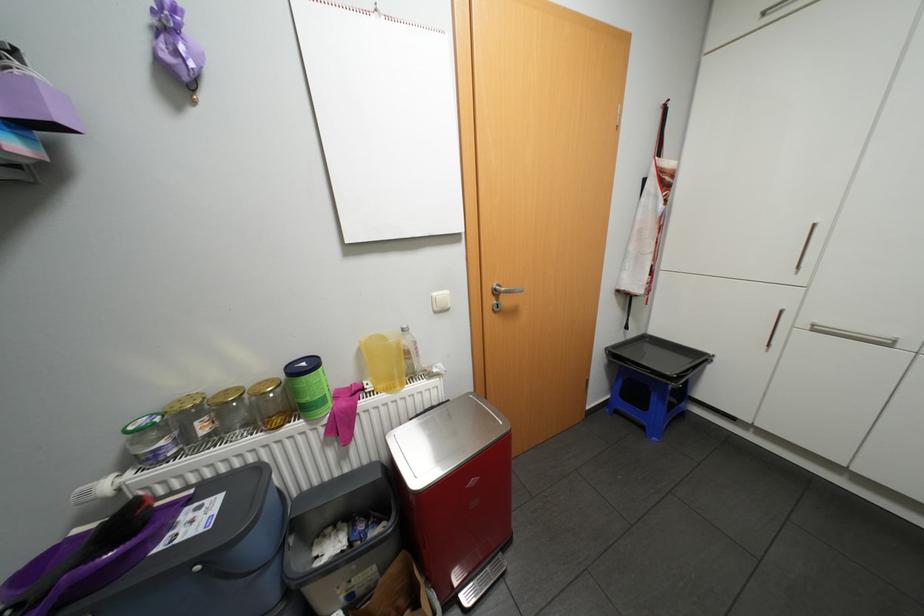
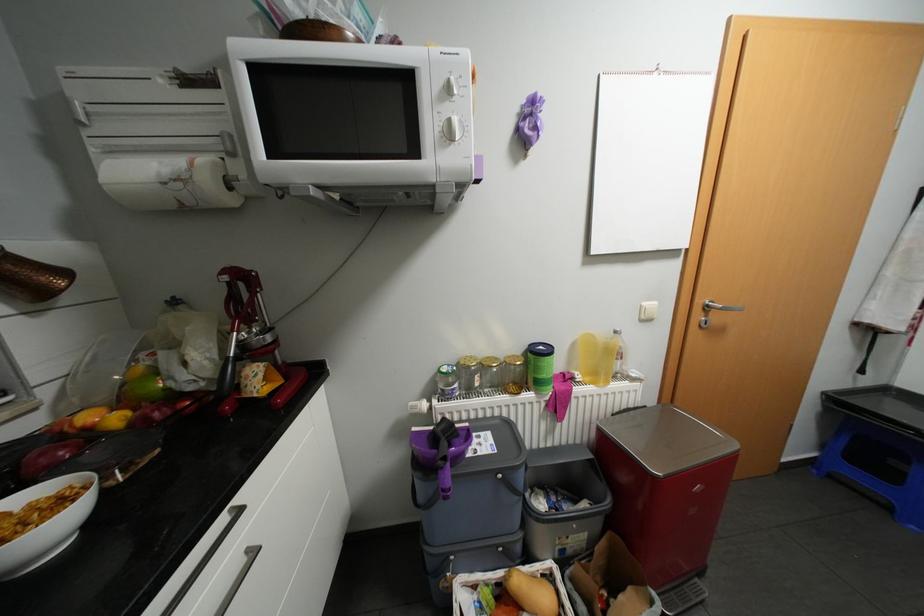
Where in the second image is the point corresponding to [246,389] from the first image?

(504, 358)